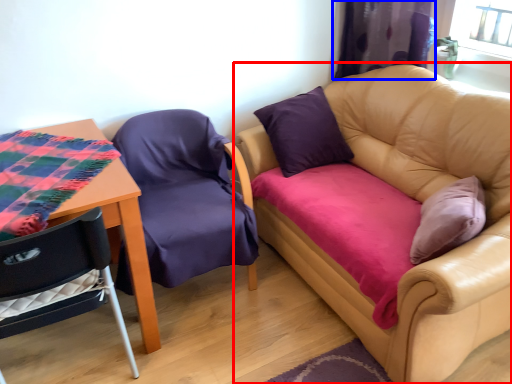
Question: Which object is further to the camera taking this photo, studio couch (highlighted by a red box) or curtain (highlighted by a blue box)?

Choices:
 (A) studio couch
 (B) curtain

Answer: (B)